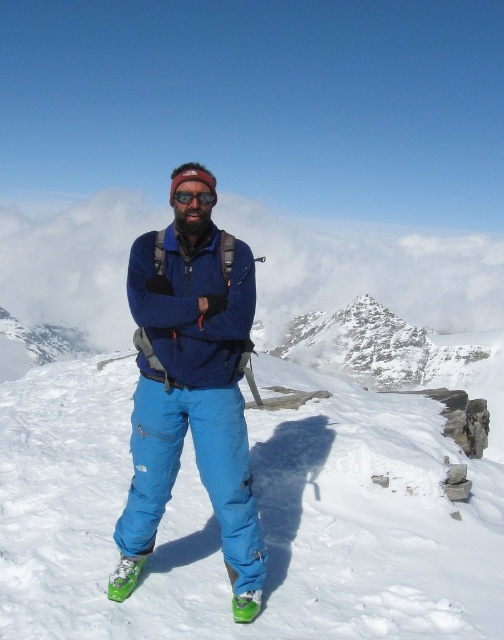
Between point (478, 589) and point (114, 209), which one is positioned behind?

The point (114, 209) is behind.

Locate an element on the screen. blue fabric ski slope at center is located at coordinates (260, 513).

This screenshot has width=504, height=640. What do you see at coordinates (260, 513) in the screenshot?
I see `blue fabric ski slope at center` at bounding box center [260, 513].

Locate an element on the screen. This screenshot has width=504, height=640. blue fabric ski slope at center is located at coordinates (260, 513).

Is white fluffy cloud at upper center positioned before black matte goggles at center?

No, white fluffy cloud at upper center is further to the viewer.

Can you confirm if white fluffy cloud at upper center is positioned below black matte goggles at center?

No, white fluffy cloud at upper center is not below black matte goggles at center.

Where is `white fluffy cloud at upper center`? The height and width of the screenshot is (640, 504). white fluffy cloud at upper center is located at coordinates (368, 268).

The height and width of the screenshot is (640, 504). I want to click on white fluffy cloud at upper center, so click(x=368, y=268).

Between blue fabric ski slope at center and black matte goggles at center, which one is positioned higher?

Positioned higher is black matte goggles at center.

Is point (146, 595) in front of point (216, 198)?

Yes, point (146, 595) is closer to viewer.

You are a GUI agent. You are given a task and a screenshot of the screen. Output one action in this format:
    pyautogui.click(x=<x>, y=<y>)
    Task: Click on the blue fabric ski slope at center
    
    Given the screenshot: What is the action you would take?
    pyautogui.click(x=260, y=513)